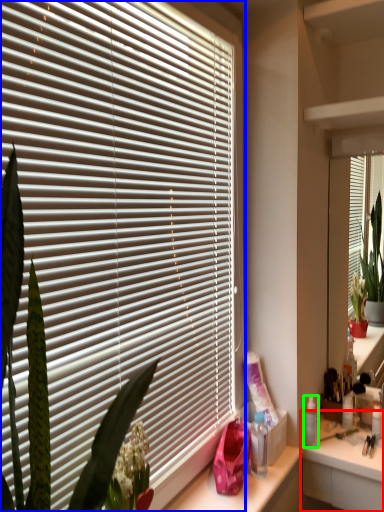
Question: Which is farther away from counter (highlighted by a red box)? window blind (highlighted by a blue box) or toiletry (highlighted by a green box)?

Choices:
 (A) window blind
 (B) toiletry

Answer: (A)